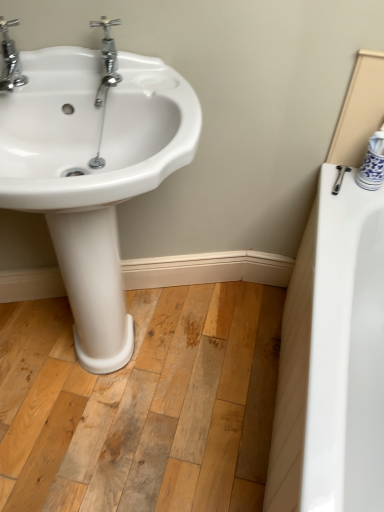
Where is `vacant space in white glossy sink at left (from a real-world perspective)`? vacant space in white glossy sink at left (from a real-world perspective) is located at coordinates (124, 348).